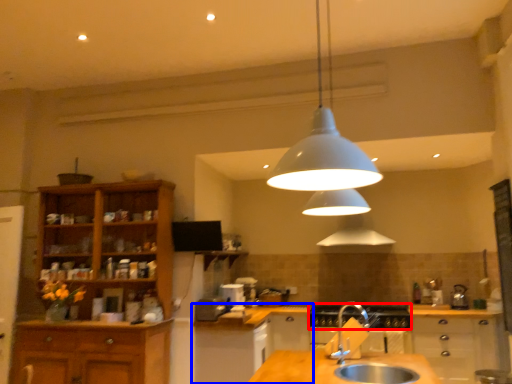
Question: Which object appears closest to the camera in this image, gas stove (highlighted by a red box) or cabinetry (highlighted by a blue box)?

Choices:
 (A) gas stove
 (B) cabinetry

Answer: (B)